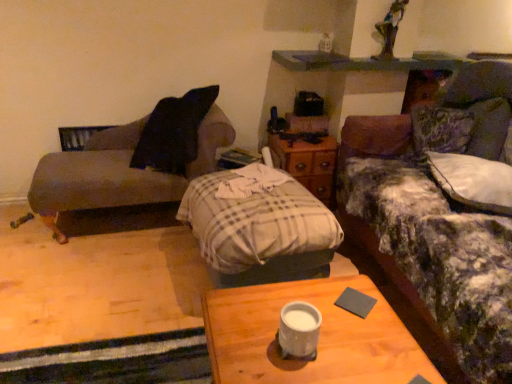
Image resolution: width=512 pixels, height=384 pixels. What are the coordinates of `free space on the front side of matte brown couch at left, which is the 1th studio couch from left to right` in the screenshot? It's located at (103, 293).